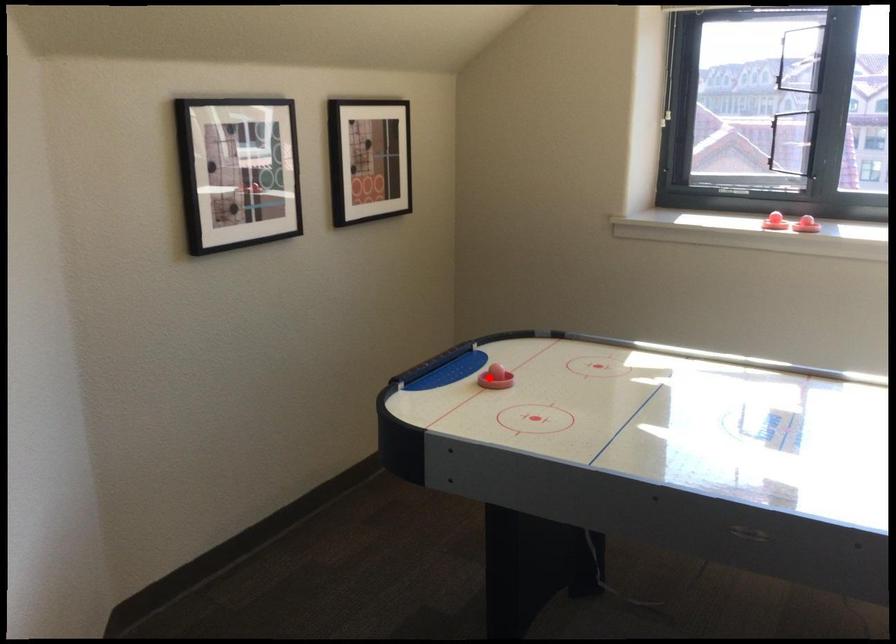
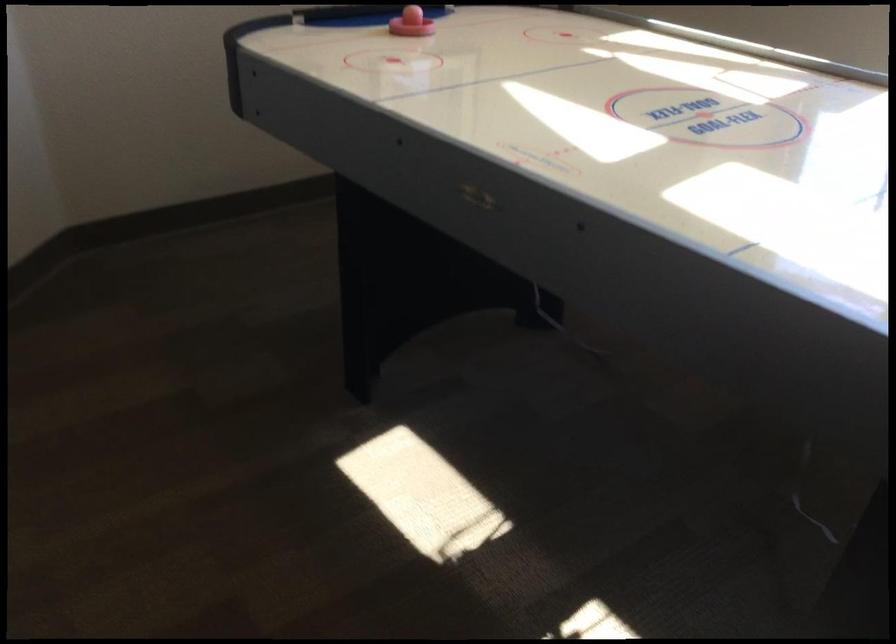
Question: I am providing you with two images of the same scene from different viewpoints. A red point is shown in image1. For the corresponding object point in image2, is it positioned nearer or farther from the camera?

Choices:
 (A) Nearer
 (B) Farther

Answer: (A)